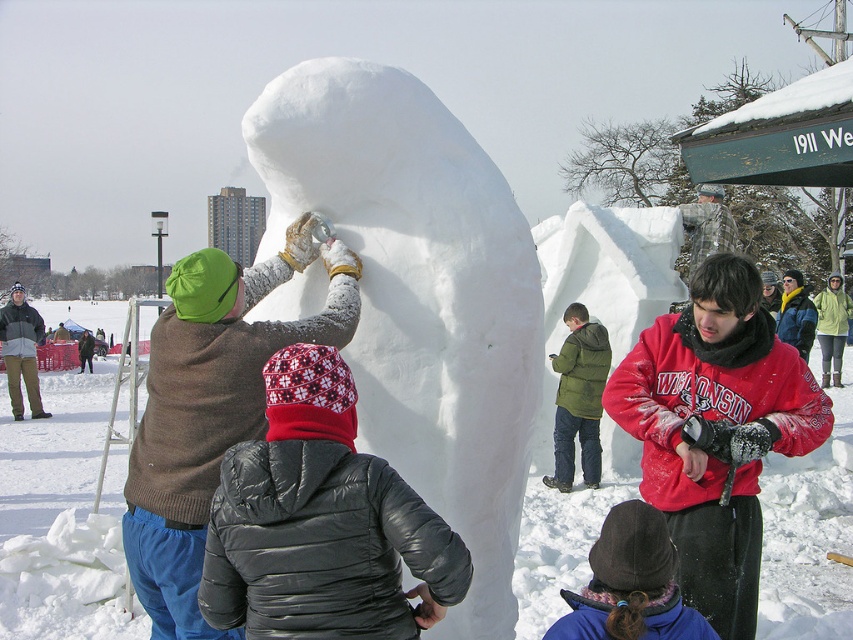
Can you confirm if white fluffy snowman at center is positioned below green puffy jacket at center?

Incorrect, white fluffy snowman at center is not positioned below green puffy jacket at center.

Between white fluffy snowman at center and green puffy jacket at center, which one appears on the right side from the viewer's perspective?

green puffy jacket at center is more to the right.

Find the location of a particular element. Image resolution: width=853 pixels, height=640 pixels. white fluffy snowman at center is located at coordinates (421, 296).

Between white fluffy snowman at center and brown wool sweater at upper left, which one is positioned lower?

Positioned lower is brown wool sweater at upper left.

Is white fluffy snowman at center to the left of brown wool sweater at upper left from the viewer's perspective?

In fact, white fluffy snowman at center is to the right of brown wool sweater at upper left.

Does point (260, 148) lie behind point (206, 410)?

Yes, it is behind point (206, 410).

Find the location of `white fluffy snowman at center`. white fluffy snowman at center is located at coordinates (421, 296).

Who is shorter, brown wool sweater at upper left or green puffy jacket at center?

With less height is brown wool sweater at upper left.

Where is `brown wool sweater at upper left`? This screenshot has width=853, height=640. brown wool sweater at upper left is located at coordinates (212, 406).

Locate an element on the screen. brown wool sweater at upper left is located at coordinates (212, 406).